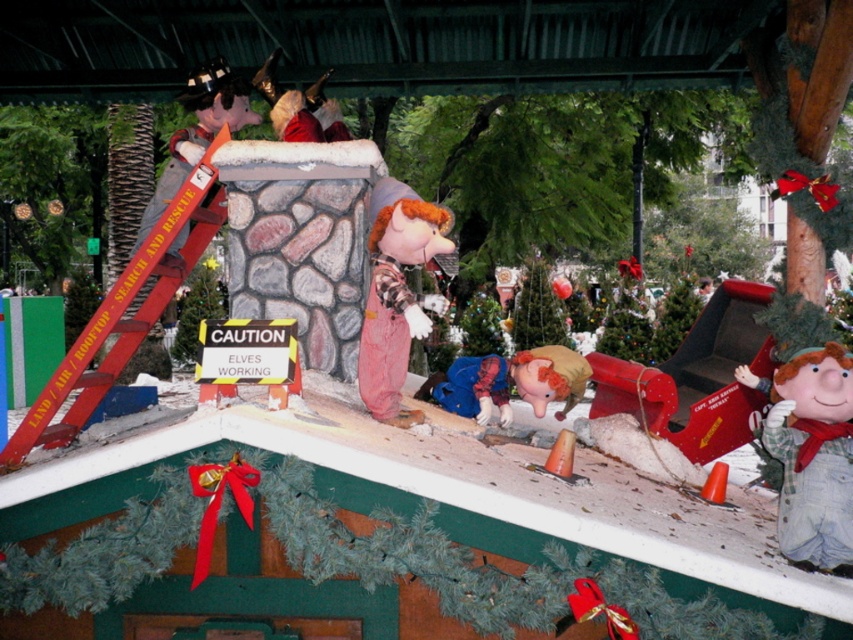
You are a visitor at the holiday display and notice the flannel shirt at lower right and the red metal ladder at upper left. Which object appears smaller in the scene?

The flannel shirt at lower right appears smaller compared to the red metal ladder at upper left.

You are standing in the festive holiday scene and need to locate the flannel shirt at lower right. According to the coordinates provided, where exactly should you look to find it?

The flannel shirt at lower right is located at point [813,456].

You are an elf trying to reach the rooftop to fix the garlands. You see a red metal ladder at upper left and a shiny silver helmet at upper left. Which object should you use to climb up to the rooftop?

The red metal ladder at upper left has a larger size compared to the shiny silver helmet at upper left, so you should use the red metal ladder at upper left to climb up to the rooftop.